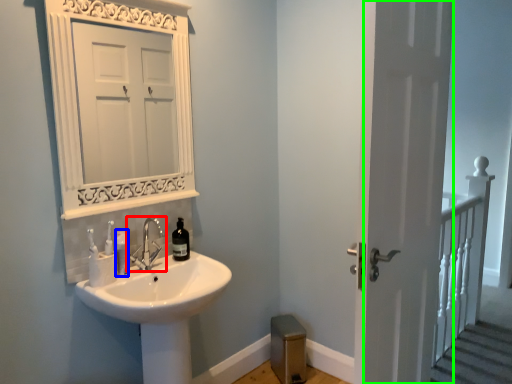
Question: Which is farther away from tap (highlighted by a red box)? toiletry (highlighted by a blue box) or screen door (highlighted by a green box)?

Choices:
 (A) toiletry
 (B) screen door

Answer: (B)